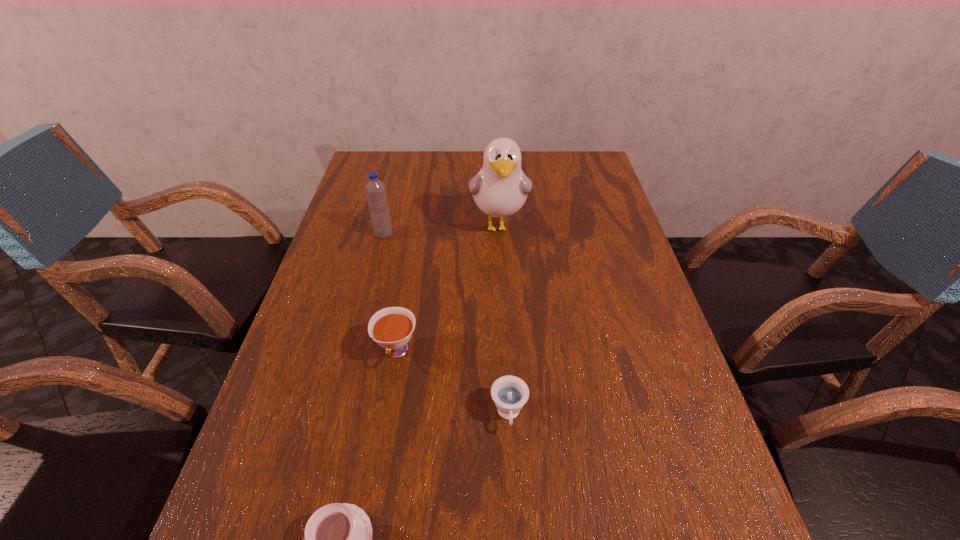
Choose which teacup is the second nearest neighbor to the nearest teacup. Please provide its 2D coordinates. Your answer should be formatted as a tuple, i.e. [(x, y)], where the tuple contains the x and y coordinates of a point satisfying the conditions above.

[(392, 327)]

Find the location of a particular element. teacup that is the closest to the shortest teacup is located at coordinates (509, 393).